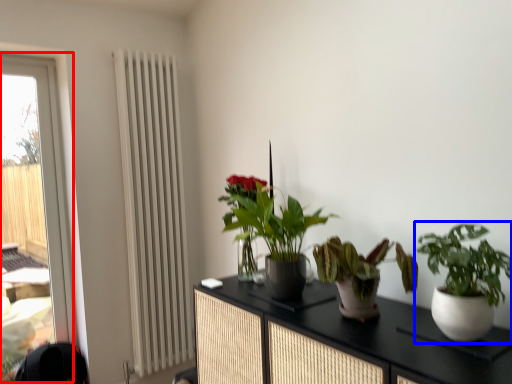
Question: Which of the following is the farthest to the observer, window (highlighted by a red box) or houseplant (highlighted by a blue box)?

Choices:
 (A) window
 (B) houseplant

Answer: (A)